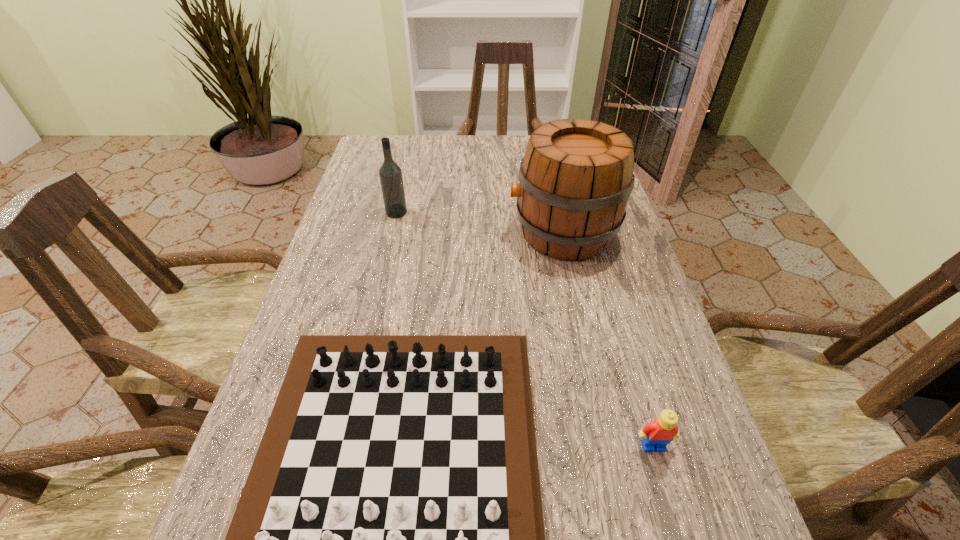
Where is `Lego located at the right edge`? The height and width of the screenshot is (540, 960). Lego located at the right edge is located at coordinates (660, 432).

In the image, there is a desktop. Where is `vacant space at the far edge`? This screenshot has height=540, width=960. vacant space at the far edge is located at coordinates (504, 159).

The width and height of the screenshot is (960, 540). Find the location of `vacant space at the left edge of the desktop`. vacant space at the left edge of the desktop is located at coordinates (332, 252).

Identify the location of free spot at the right edge of the desktop. This screenshot has width=960, height=540. (663, 322).

Where is `free area in between the third tallest object and the tallest object`? free area in between the third tallest object and the tallest object is located at coordinates (608, 339).

I want to click on vacant point located between the third tallest object and the tallest object, so click(x=608, y=339).

Identify the location of free spot between the vodka and the second shortest object. (525, 329).

Select which object is the third closest to the vodka. Please provide its 2D coordinates. Your answer should be formatted as a tuple, i.e. [(x, y)], where the tuple contains the x and y coordinates of a point satisfying the conditions above.

[(660, 432)]

The height and width of the screenshot is (540, 960). I want to click on object that is the closest to the tallest object, so click(389, 539).